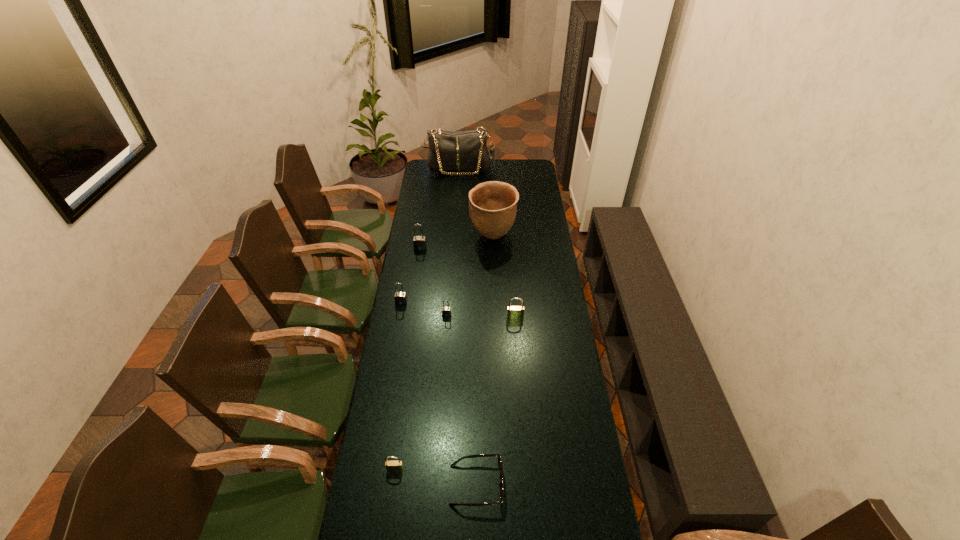
Locate an element on the screen. Image resolution: width=960 pixels, height=540 pixels. the nearest padlock is located at coordinates (392, 466).

Locate an element on the screen. Image resolution: width=960 pixels, height=540 pixels. the nearer brass padlock is located at coordinates (392, 466).

Locate an element on the screen. spectacles is located at coordinates (500, 465).

Find the location of a particular element. The height and width of the screenshot is (540, 960). vacant point located at the front of the farthest object with chain and zipper is located at coordinates (457, 204).

Identify the location of vacant space located on the back of the pottery. This screenshot has width=960, height=540. (492, 208).

Locate an element on the screen. free space located 0.220m on the shackle of the third tallest object is located at coordinates (416, 281).

Find the location of a particular element. The image size is (960, 540). vacant space located on the shackle of the fifth nearest object is located at coordinates (395, 343).

Find the location of a particular element. This screenshot has width=960, height=540. vacant space located on the front-facing side of the right brass padlock is located at coordinates click(x=519, y=373).

Where is `free space located on the shackle of the nearest gray padlock`? This screenshot has height=540, width=960. free space located on the shackle of the nearest gray padlock is located at coordinates (443, 370).

Locate an element on the screen. vacant space situated 0.080m on the front-facing side of the nearer brass padlock is located at coordinates (392, 498).